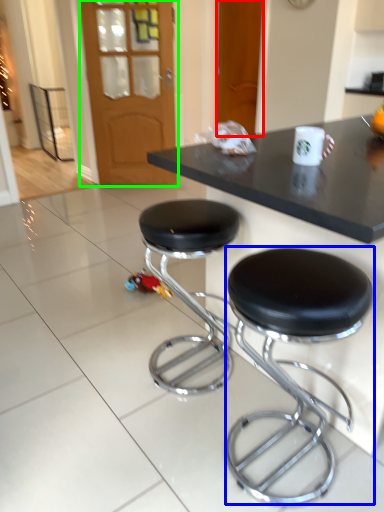
Question: Which object is the closest to the door (highlighted by a red box)? Choose among these: stool (highlighted by a blue box) or glass door (highlighted by a green box).

Choices:
 (A) stool
 (B) glass door

Answer: (B)